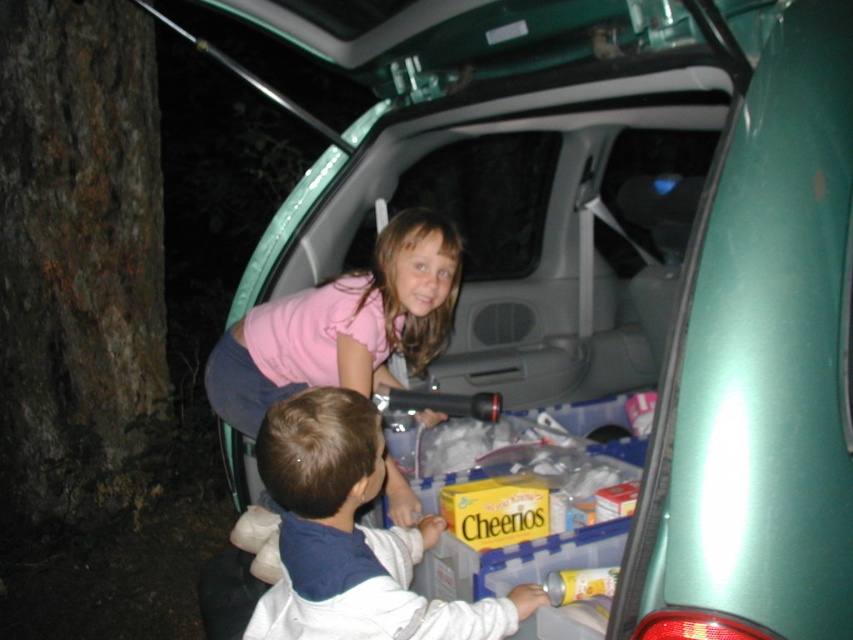
Can you confirm if white fleece jacket at lower center is wider than pink fabric shirt at center?

In fact, white fleece jacket at lower center might be narrower than pink fabric shirt at center.

Who is lower down, white fleece jacket at lower center or pink fabric shirt at center?

white fleece jacket at lower center

Is point (346, 408) closer to camera compared to point (396, 497)?

Yes, it is.

Identify the location of white fleece jacket at lower center. Image resolution: width=853 pixels, height=640 pixels. (352, 536).